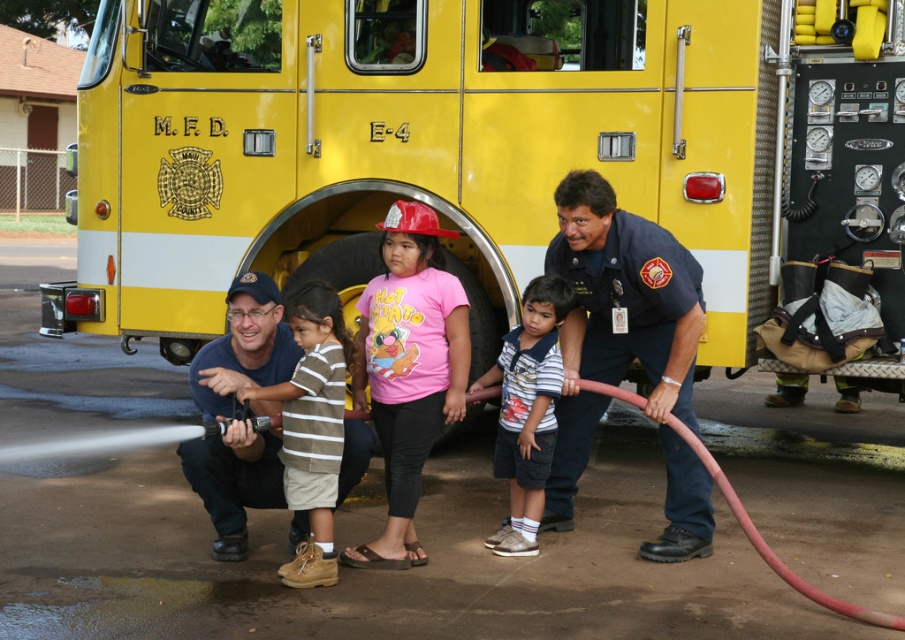
Question: Which point is farther to the camera?

Choices:
 (A) rubber/matte fire hose at lower center
 (B) dark blue uniform at center
 (C) brown suede shoes at lower center
 (D) yellow matte fire truck at center

Answer: (D)

Question: Can you confirm if brown suede shoes at lower center is positioned below rubber/matte fire hose at lower center?

Choices:
 (A) no
 (B) yes

Answer: (A)

Question: Which of the following is the farthest from the observer?

Choices:
 (A) (675, 353)
 (B) (498, 28)

Answer: (B)

Question: Among these points, which one is nearest to the camera?

Choices:
 (A) (291, 392)
 (B) (556, 317)
 (C) (589, 248)
 (D) (579, 280)

Answer: (A)

Question: Can you confirm if matte black uniform at center is positioned above rubber/matte fire hose at lower center?

Choices:
 (A) no
 (B) yes

Answer: (B)

Question: Can you confirm if brown suede shoes at lower center is thinner than striped cotton shirt at center?

Choices:
 (A) no
 (B) yes

Answer: (B)